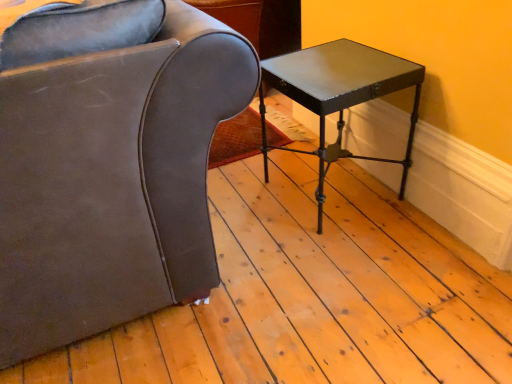
Where is `free space behind glossy black table at right`? The width and height of the screenshot is (512, 384). free space behind glossy black table at right is located at coordinates (288, 143).